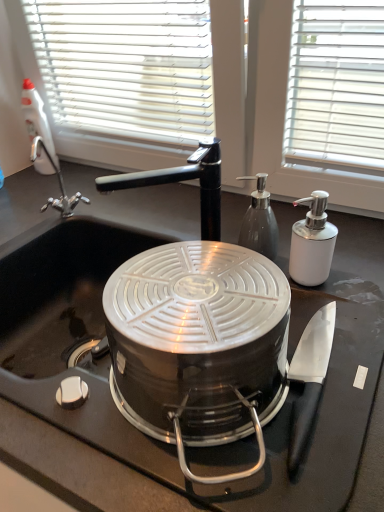
Question: Which is correct: white glossy soap dispenser at right, marked as the second kitchen appliance in a left-to-right arrangement, is inside black matte sink at center, or outside of it?

Choices:
 (A) inside
 (B) outside

Answer: (B)

Question: From the image's perspective, is white glossy soap dispenser at right, the first kitchen appliance positioned from the right, positioned above or below black matte sink at center?

Choices:
 (A) below
 (B) above

Answer: (B)

Question: Which of these objects is positioned farthest from the black matte sink at center?

Choices:
 (A) white plastic spray bottle at upper left
 (B) white glossy soap dispenser at right, marked as the second kitchen appliance in a left-to-right arrangement
 (C) translucent glass soap dispenser at center, the 1th kitchen appliance in the left-to-right sequence

Answer: (B)

Question: Which object is positioned farthest from the white plastic spray bottle at upper left?

Choices:
 (A) white glossy soap dispenser at right, the first kitchen appliance positioned from the right
 (B) black matte sink at center
 (C) translucent glass soap dispenser at center, the 1th kitchen appliance in the left-to-right sequence

Answer: (A)